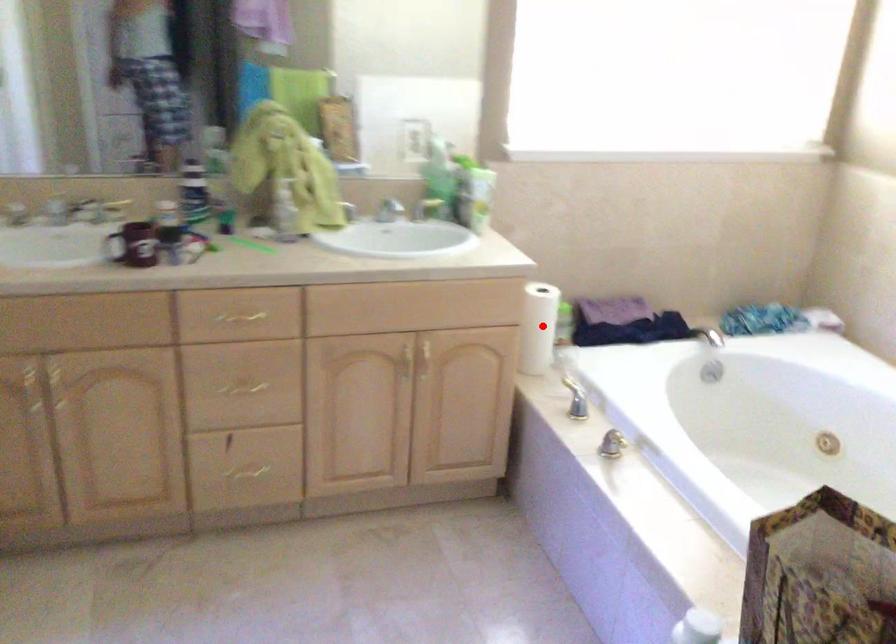
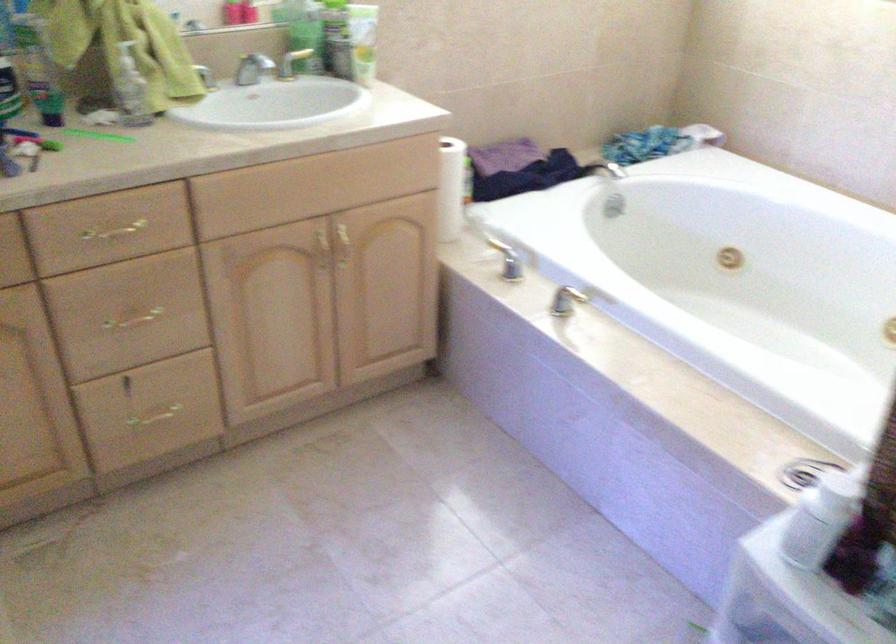
The point at the highlighted location is marked in the first image. Where is the corresponding point in the second image?

(451, 187)